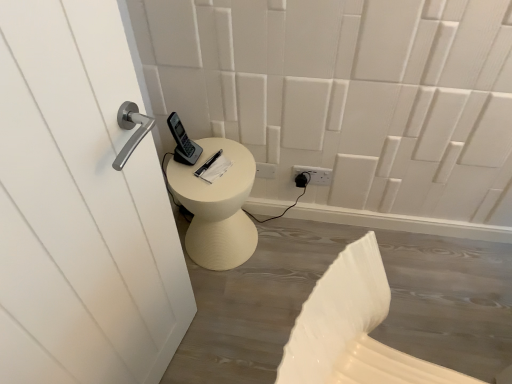
Question: In which direction should I rotate to look at white plastic electric outlet at lower center?

Choices:
 (A) left
 (B) right

Answer: (B)

Question: Are white plastic swivel chair at lower right and white plastic electric outlet at lower center beside each other?

Choices:
 (A) no
 (B) yes

Answer: (A)

Question: From a real-world perspective, does white plastic swivel chair at lower right stand above white plastic electric outlet at lower center?

Choices:
 (A) no
 (B) yes

Answer: (B)

Question: Can you confirm if white plastic swivel chair at lower right is taller than white plastic electric outlet at lower center?

Choices:
 (A) no
 (B) yes

Answer: (B)

Question: Is white plastic swivel chair at lower right closer to camera compared to white plastic electric outlet at lower center?

Choices:
 (A) yes
 (B) no

Answer: (A)

Question: From a real-world perspective, is white plastic swivel chair at lower right physically below white plastic electric outlet at lower center?

Choices:
 (A) no
 (B) yes

Answer: (A)

Question: Does white plastic swivel chair at lower right have a smaller size compared to white plastic electric outlet at lower center?

Choices:
 (A) no
 (B) yes

Answer: (A)

Question: Can you confirm if white plastic electric outlet at lower center is bigger than white plastic swivel chair at lower right?

Choices:
 (A) no
 (B) yes

Answer: (A)

Question: Does white plastic electric outlet at lower center have a lesser height compared to white plastic swivel chair at lower right?

Choices:
 (A) yes
 (B) no

Answer: (A)

Question: Would you say white plastic electric outlet at lower center contains white plastic swivel chair at lower right?

Choices:
 (A) no
 (B) yes

Answer: (A)

Question: Considering the relative positions of white plastic electric outlet at lower center and white plastic swivel chair at lower right in the image provided, is white plastic electric outlet at lower center to the right of white plastic swivel chair at lower right from the viewer's perspective?

Choices:
 (A) yes
 (B) no

Answer: (B)

Question: Does white plastic electric outlet at lower center appear on the left side of white plastic swivel chair at lower right?

Choices:
 (A) yes
 (B) no

Answer: (A)

Question: Is white plastic electric outlet at lower center wider than white plastic swivel chair at lower right?

Choices:
 (A) yes
 (B) no

Answer: (B)

Question: Does point (318, 180) appear closer or farther from the camera than point (376, 271)?

Choices:
 (A) farther
 (B) closer

Answer: (A)